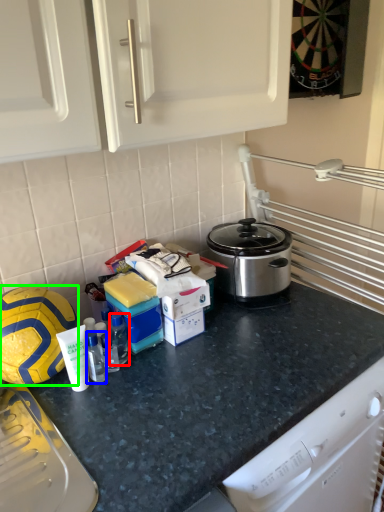
Question: Which object is positioned closest to bottle (highlighted by a red box)? Select from bottle (highlighted by a blue box) and football (highlighted by a green box).

Choices:
 (A) bottle
 (B) football

Answer: (A)